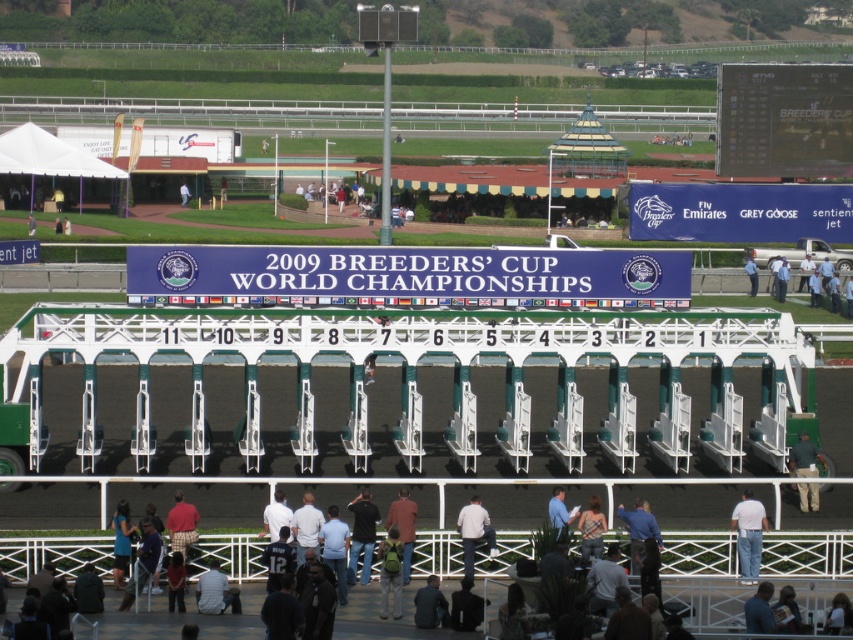
You are a photographer at the 2009 Breeders Cup World Championships. You need to capture a photo of the starting gate while ensuring both the light brown leather jacket at center and red plaid pants at lower center are visible. Based on their positions, which object should be closer to the bottom of the photo?

The light brown leather jacket at center should be closer to the bottom of the photo because it is below the red plaid pants at lower center.

You are a photographer standing at the camera position. You want to take a photo of the light brown leather jacket at center. Is the jacket within your camera lens range if the maximum distance your camera can focus is 40 meters?

The light brown leather jacket at center is 47.00 meters away from the camera. Since the maximum focus distance is 40 meters, the jacket is beyond the camera lens range and cannot be captured clearly.